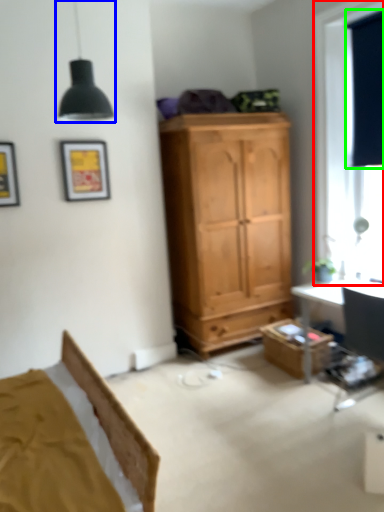
Question: Which object is the closest to the window (highlighted by a red box)? Choose among these: light fixture (highlighted by a blue box) or curtain (highlighted by a green box).

Choices:
 (A) light fixture
 (B) curtain

Answer: (B)